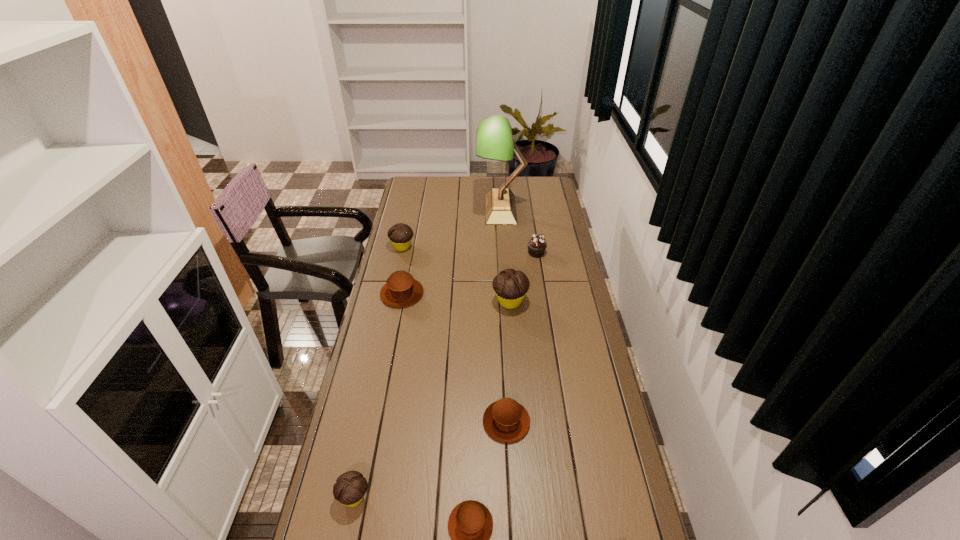
This screenshot has height=540, width=960. In order to click on unoccupied position between the biggest brown muffin and the cupcake in this screenshot , I will do `click(469, 273)`.

The height and width of the screenshot is (540, 960). I want to click on free area in between the tallest object and the farthest chocolate muffin, so click(x=451, y=228).

Identify the location of free point between the biggest brown muffin and the nearest chocolate muffin. (378, 395).

This screenshot has width=960, height=540. I want to click on vacant space in between the leftmost brown muffin and the second smallest chocolate muffin, so click(402, 270).

Identify which object is the third closest to the second smallest chocolate muffin. Please provide its 2D coordinates. Your answer should be formatted as a tuple, i.e. [(x, y)], where the tuple contains the x and y coordinates of a point satisfying the conditions above.

[(510, 286)]

Locate which object ranks fifth in proximity to the farthest brown muffin. Please provide its 2D coordinates. Your answer should be formatted as a tuple, i.e. [(x, y)], where the tuple contains the x and y coordinates of a point satisfying the conditions above.

[(505, 420)]

Where is `muffin that is the third closest one to the brown cupcake`? Image resolution: width=960 pixels, height=540 pixels. muffin that is the third closest one to the brown cupcake is located at coordinates pyautogui.click(x=400, y=235).

I want to click on muffin that is the sixth closest one to the cupcake, so coord(350,487).

Identify which chocolate muffin is the second closest to the farthest chocolate muffin. Please provide its 2D coordinates. Your answer should be formatted as a tuple, i.e. [(x, y)], where the tuple contains the x and y coordinates of a point satisfying the conditions above.

[(350, 487)]

Locate an element on the screen. This screenshot has width=960, height=540. the third closest chocolate muffin to the biggest brown muffin is located at coordinates (350, 487).